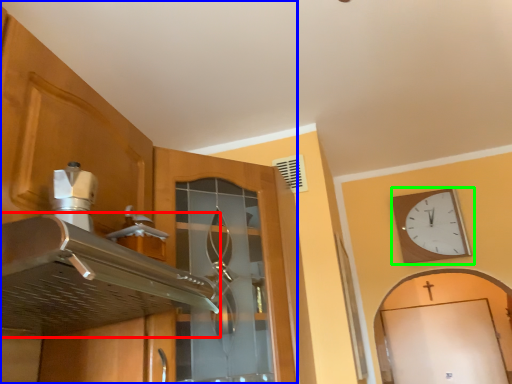
Question: Which is farther away from exhaust hood (highlighted by a red box)? cabinetry (highlighted by a blue box) or wall clock (highlighted by a green box)?

Choices:
 (A) cabinetry
 (B) wall clock

Answer: (B)